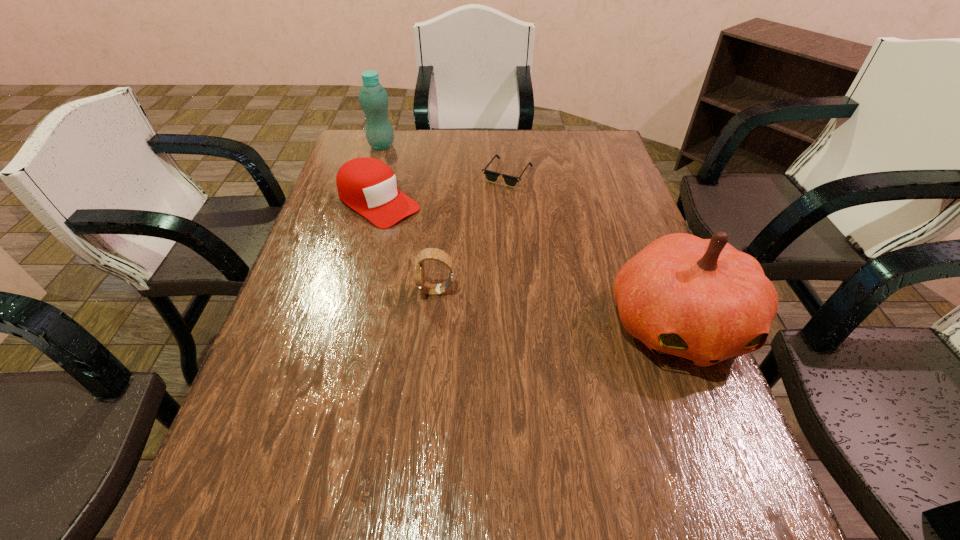
You are a GUI agent. You are given a task and a screenshot of the screen. Output one action in this format:
    pyautogui.click(x=<x>, y=<y>)
    Task: Click on the vacant space on the desktop that is between the third object from left to right and the rightmost object and is positioned on the lenses of the second object from right to left
    The height and width of the screenshot is (540, 960).
    Given the screenshot: What is the action you would take?
    pyautogui.click(x=532, y=304)

This screenshot has height=540, width=960. Identify the location of vacant space on the desktop that is between the watch and the pumpkin and is positioned at the front cap of the water bottle. (528, 303).

Image resolution: width=960 pixels, height=540 pixels. I want to click on free space on the desktop that is between the third object from right to left and the rightmost object and is positioned on the front-facing side of the baseball cap, so click(x=523, y=303).